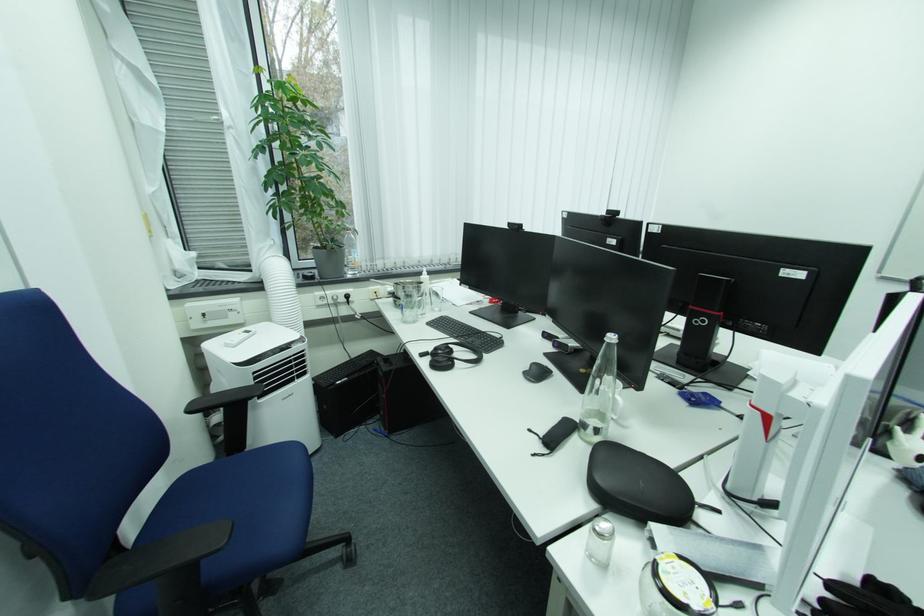
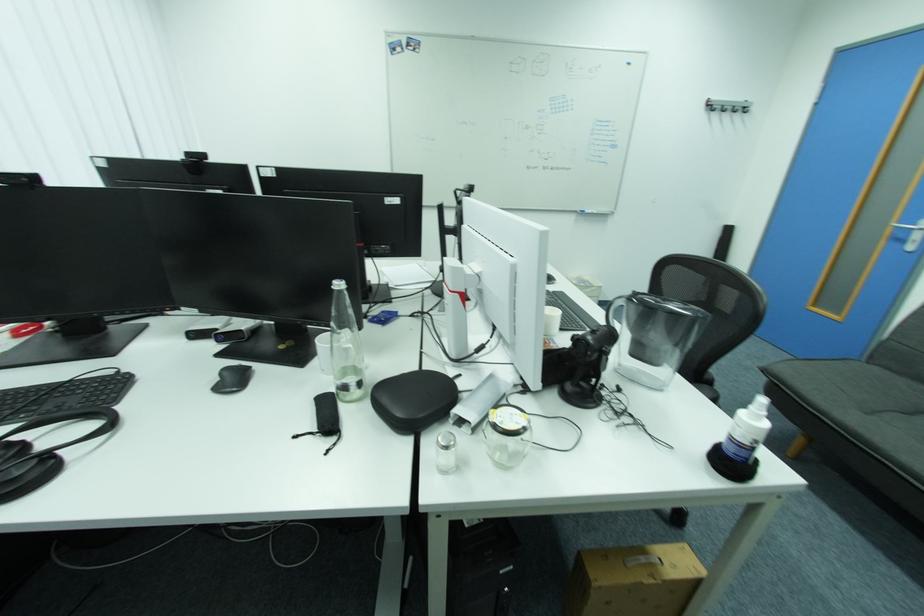
Locate, in the second image, the point that corresponds to (681,570) in the first image.

(506, 418)